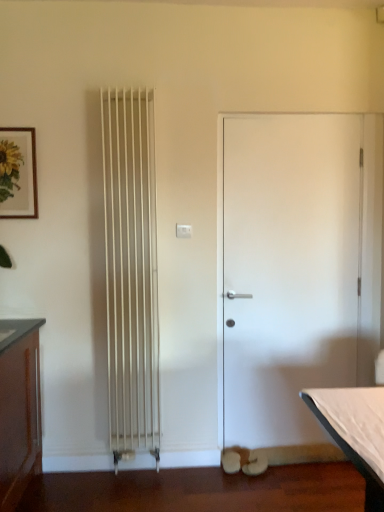
Where is `blank space situated above white matte door at center (from a real-world perspective)`? Image resolution: width=384 pixels, height=512 pixels. blank space situated above white matte door at center (from a real-world perspective) is located at coordinates (291, 119).